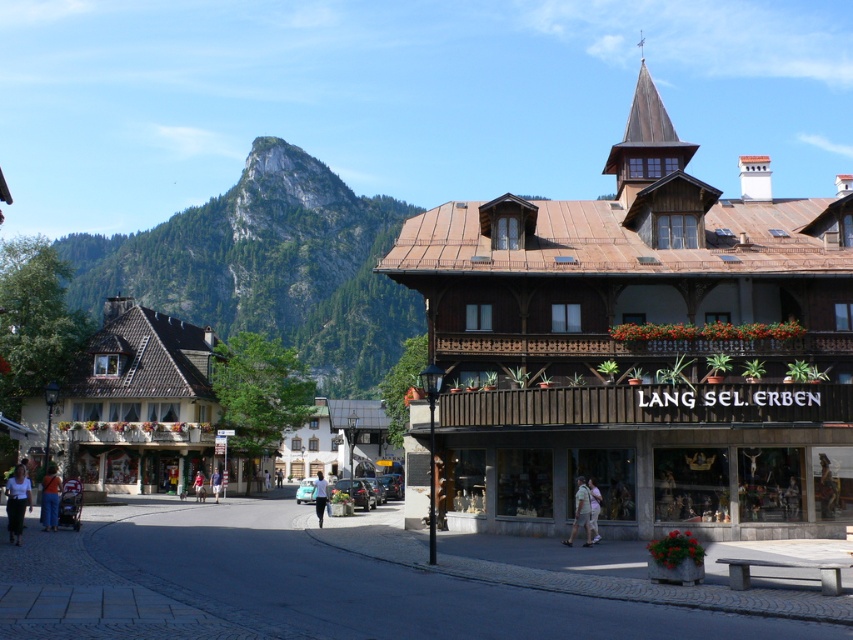
Question: Does light blue shirt at center have a larger size compared to light blue denim shorts at center?

Choices:
 (A) no
 (B) yes

Answer: (B)

Question: Which point appears farthest from the camera in this image?

Choices:
 (A) (53, 476)
 (B) (199, 484)
 (C) (7, 497)
 (D) (218, 492)

Answer: (D)

Question: Which point appears farthest from the camera in this image?

Choices:
 (A) (218, 470)
 (B) (582, 486)

Answer: (A)

Question: Which object is the farthest from the denim pants at lower left?

Choices:
 (A) light blue denim shorts at center
 (B) light beige shorts at lower center

Answer: (B)

Question: Can you confirm if rocky cliff at upper left is positioned to the left of light beige shorts at lower center?

Choices:
 (A) no
 (B) yes

Answer: (B)

Question: Is white cotton shirt at lower left to the left of denim pants at lower left from the viewer's perspective?

Choices:
 (A) no
 (B) yes

Answer: (A)